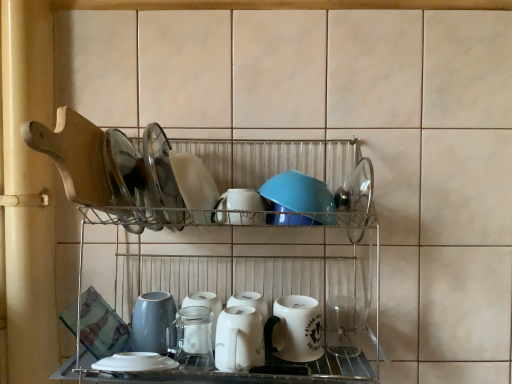
In order to face white glossy mug at center, which is counted as the 3th tableware, starting from the top, should I rotate leftwards or rightwards?

Turn left approximately 2.704 degrees to face it.

Find the location of a particular element. The image size is (512, 384). blue matte bowl at center, marked as the 3th tableware in a bottom-to-top arrangement is located at coordinates (297, 193).

You are a GUI agent. You are given a task and a screenshot of the screen. Output one action in this format:
    pyautogui.click(x=<x>, y=<y>)
    Task: Click on the white glossy mug at lower center
    Image resolution: width=512 pixels, height=384 pixels.
    Given the screenshot: What is the action you would take?
    pyautogui.click(x=295, y=329)

Where is `white glossy mug at center, which is counted as the 3th tableware, starting from the top`? white glossy mug at center, which is counted as the 3th tableware, starting from the top is located at coordinates (239, 208).

Can you tell me how much metallic wire rack at center and white glossy plate at center, arranged as the fourth tableware when ordered from the bottom, differ in facing direction?

metallic wire rack at center and white glossy plate at center, arranged as the fourth tableware when ordered from the bottom, are facing 0.532 degrees away from each other.

Is metallic wire rack at center looking in the opposite direction of white glossy plate at center, arranged as the fourth tableware when ordered from the bottom?

Yes, white glossy plate at center, arranged as the fourth tableware when ordered from the bottom, is at the back of metallic wire rack at center.

Which of these two, metallic wire rack at center or white glossy plate at center, arranged as the fourth tableware when ordered from the bottom, is smaller?

Smaller between the two is white glossy plate at center, arranged as the fourth tableware when ordered from the bottom.

Which object is further away from the camera, metallic wire rack at center or white glossy plate at center, arranged as the fourth tableware when ordered from the bottom?

white glossy plate at center, arranged as the fourth tableware when ordered from the bottom.

Is white glossy kettle at center, marked as the 1th tableware in a bottom-to-top arrangement, aimed at metallic wire rack at center?

Yes, white glossy kettle at center, marked as the 1th tableware in a bottom-to-top arrangement, is oriented towards metallic wire rack at center.

Based on their positions, is white glossy kettle at center, the fourth tableware positioned from the top, located to the left or right of metallic wire rack at center?

white glossy kettle at center, the fourth tableware positioned from the top, is to the right of metallic wire rack at center.

From the image's perspective, is white glossy kettle at center, the fourth tableware positioned from the top, positioned above or below metallic wire rack at center?

Clearly, from the image's perspective, white glossy kettle at center, the fourth tableware positioned from the top, is below metallic wire rack at center.

Consider the image. From the image's perspective, is blue matte bowl at center, acting as the second tableware starting from the top, positioned above or below metallic wire rack at center?

From the image's perspective, blue matte bowl at center, acting as the second tableware starting from the top, appears above metallic wire rack at center.

Is blue matte bowl at center, marked as the 3th tableware in a bottom-to-top arrangement, wider than metallic wire rack at center?

Incorrect, the width of blue matte bowl at center, marked as the 3th tableware in a bottom-to-top arrangement, does not surpass that of metallic wire rack at center.

Is point (294, 199) farther from camera compared to point (264, 371)?

No, it is not.

Is metallic wire rack at center completely or partially inside blue matte bowl at center, marked as the 3th tableware in a bottom-to-top arrangement?

No, metallic wire rack at center is located outside of blue matte bowl at center, marked as the 3th tableware in a bottom-to-top arrangement.

In the scene shown: In the image, is blue matte bowl at center, marked as the 3th tableware in a bottom-to-top arrangement, positioned in front of or behind white glossy kettle at center, the fourth tableware positioned from the top?

blue matte bowl at center, marked as the 3th tableware in a bottom-to-top arrangement, is positioned farther from the viewer than white glossy kettle at center, the fourth tableware positioned from the top.

Is blue matte bowl at center, acting as the second tableware starting from the top, not within white glossy kettle at center, marked as the 1th tableware in a bottom-to-top arrangement?

Yes, blue matte bowl at center, acting as the second tableware starting from the top, is located beyond the bounds of white glossy kettle at center, marked as the 1th tableware in a bottom-to-top arrangement.

Find the location of a particular element. This screenshot has height=384, width=512. tableware that is the 2nd one below the blue matte bowl at center, marked as the 3th tableware in a bottom-to-top arrangement (from a real-world perspective) is located at coordinates (239, 339).

Is blue matte bowl at center, acting as the second tableware starting from the top, positioned with its back to white glossy kettle at center, the fourth tableware positioned from the top?

No, white glossy kettle at center, the fourth tableware positioned from the top, is not at the back of blue matte bowl at center, acting as the second tableware starting from the top.

Considering the positions of points (283, 319) and (374, 278), is point (283, 319) farther from camera compared to point (374, 278)?

No.

Looking at this image, which is in front, white glossy mug at lower center or metallic wire rack at center?

Positioned in front is metallic wire rack at center.

From the image's perspective, which is below, white glossy mug at lower center or metallic wire rack at center?

white glossy mug at lower center.

Between white glossy mug at lower center and metallic wire rack at center, which one has larger width?

Wider between the two is metallic wire rack at center.

Can you see white glossy plate at center, which appears as the first tableware when viewed from the top, touching white glossy mug at center, which is counted as the 3th tableware, starting from the top?

Yes, white glossy plate at center, which appears as the first tableware when viewed from the top, is beside white glossy mug at center, which is counted as the 3th tableware, starting from the top.

Is white glossy mug at center, which is the 2th tableware in bottom-to-top order, at the back of white glossy plate at center, arranged as the fourth tableware when ordered from the bottom?

white glossy plate at center, arranged as the fourth tableware when ordered from the bottom, does not have its back to white glossy mug at center, which is the 2th tableware in bottom-to-top order.

Starting from the white glossy plate at center, which appears as the first tableware when viewed from the top, which tableware is the 2nd one to the right? Please provide its 2D coordinates.

[(239, 208)]

From a real-world perspective, is white glossy plate at center, which appears as the first tableware when viewed from the top, physically below white glossy mug at center, which is counted as the 3th tableware, starting from the top?

No, from a real-world perspective, white glossy plate at center, which appears as the first tableware when viewed from the top, is not under white glossy mug at center, which is counted as the 3th tableware, starting from the top.

Between point (319, 316) and point (211, 204), which one is positioned in front?

Point (211, 204)

Identify the location of the 1st tableware in front when counting from the white glossy mug at lower center. The image size is (512, 384). (194, 187).

Considering the positions of objects white glossy mug at lower center and white glossy plate at center, arranged as the fourth tableware when ordered from the bottom, in the image provided, who is more to the left, white glossy mug at lower center or white glossy plate at center, arranged as the fourth tableware when ordered from the bottom,?

white glossy plate at center, arranged as the fourth tableware when ordered from the bottom, is more to the left.

Considering the sizes of objects white glossy mug at lower center and white glossy plate at center, arranged as the fourth tableware when ordered from the bottom, in the image provided, who is bigger, white glossy mug at lower center or white glossy plate at center, arranged as the fourth tableware when ordered from the bottom,?

Bigger between the two is white glossy plate at center, arranged as the fourth tableware when ordered from the bottom.

The image size is (512, 384). What are the coordinates of `shelf that appears below the white glossy plate at center, arranged as the fourth tableware when ordered from the bottom (from the image's perspective)` in the screenshot? It's located at (230, 291).

Find the location of a particular element. This screenshot has height=384, width=512. shelf on the left side of white glossy kettle at center, the fourth tableware positioned from the top is located at coordinates (230, 291).

Which object lies nearer to the anchor point white glossy plate at center, which appears as the first tableware when viewed from the top, white glossy kettle at center, marked as the 1th tableware in a bottom-to-top arrangement, or white glossy mug at lower center?

white glossy kettle at center, marked as the 1th tableware in a bottom-to-top arrangement.

Considering their positions, is white glossy mug at center, which is counted as the 3th tableware, starting from the top, positioned closer to white glossy plate at center, arranged as the fourth tableware when ordered from the bottom, than white glossy mug at lower center?

The object closer to white glossy plate at center, arranged as the fourth tableware when ordered from the bottom, is white glossy mug at center, which is counted as the 3th tableware, starting from the top.

Which object lies further to the anchor point white glossy mug at center, which is the 2th tableware in bottom-to-top order, white glossy plate at center, which appears as the first tableware when viewed from the top, or metallic wire rack at center?

metallic wire rack at center is further to white glossy mug at center, which is the 2th tableware in bottom-to-top order.

When comparing their distances from metallic wire rack at center, does white glossy mug at lower center or white glossy mug at center, which is counted as the 3th tableware, starting from the top, seem closer?

The object closer to metallic wire rack at center is white glossy mug at lower center.

Looking at the image, which one is located further to blue matte bowl at center, marked as the 3th tableware in a bottom-to-top arrangement, white glossy mug at center, which is the 2th tableware in bottom-to-top order, or white glossy plate at center, arranged as the fourth tableware when ordered from the bottom?

Based on the image, white glossy plate at center, arranged as the fourth tableware when ordered from the bottom, appears to be further to blue matte bowl at center, marked as the 3th tableware in a bottom-to-top arrangement.

Estimate the real-world distances between objects in this image. Which object is further from white glossy kettle at center, the fourth tableware positioned from the top, white glossy plate at center, arranged as the fourth tableware when ordered from the bottom, or blue matte bowl at center, acting as the second tableware starting from the top?

Among the two, white glossy plate at center, arranged as the fourth tableware when ordered from the bottom, is located further to white glossy kettle at center, the fourth tableware positioned from the top.

From the image, which object appears to be nearer to white glossy kettle at center, marked as the 1th tableware in a bottom-to-top arrangement, white glossy mug at lower center or metallic wire rack at center?

white glossy mug at lower center.

Consider the image. Estimate the real-world distances between objects in this image. Which object is closer to metallic wire rack at center, white glossy mug at center, which is counted as the 3th tableware, starting from the top, or white glossy mug at lower center?

The object closer to metallic wire rack at center is white glossy mug at lower center.

Locate an element on the screen. The width and height of the screenshot is (512, 384). shelf between white glossy mug at center, which is counted as the 3th tableware, starting from the top, and white glossy kettle at center, the fourth tableware positioned from the top, in the vertical direction is located at coordinates click(230, 291).

The width and height of the screenshot is (512, 384). I want to click on shelf between white glossy plate at center, which appears as the first tableware when viewed from the top, and white glossy mug at lower center vertically, so click(x=230, y=291).

At what (x,y) coordinates should I click in order to perform the action: click on tableware between blue matte bowl at center, marked as the 3th tableware in a bottom-to-top arrangement, and white glossy kettle at center, marked as the 1th tableware in a bottom-to-top arrangement, in the up-down direction. Please return your answer as a coordinate pair (x, y). Looking at the image, I should click on [x=239, y=208].

At what (x,y) coordinates should I click in order to perform the action: click on shelf between white glossy plate at center, which appears as the first tableware when viewed from the top, and white glossy kettle at center, marked as the 1th tableware in a bottom-to-top arrangement, from top to bottom. Please return your answer as a coordinate pair (x, y). Looking at the image, I should click on (230, 291).